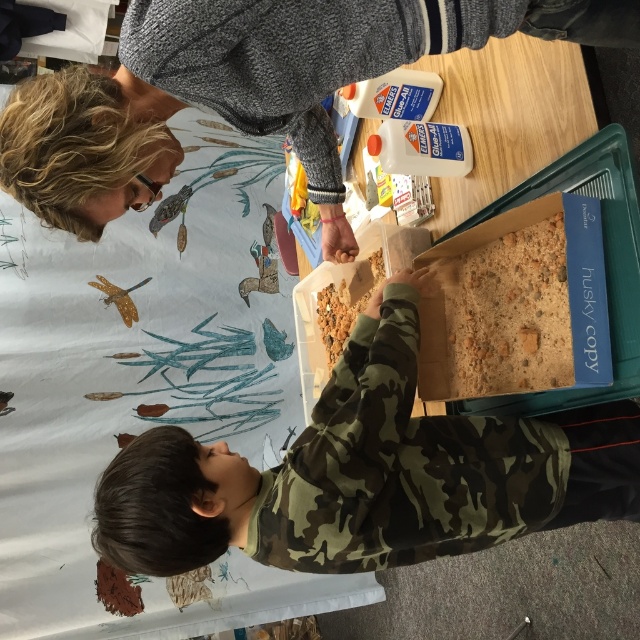
You are a teacher observing a classroom activity. You notice the camouflage fabric at center and the brown crumbly food at center. Which object takes up more space on the table?

The camouflage fabric at center is bigger than the brown crumbly food at center, so it takes up more space on the table.

You are observing a craft activity and need to determine the order of objects from closest to farthest. Which object is closer to you between the camouflage sweater at center and the brown crumbly food at center?

The camouflage sweater at center is closer to the viewer than the brown crumbly food at center according to the description.

You are standing in the classroom and want to reach the point marked at coordinates [484,467]. Can you estimate how far you need to walk to get there?

The distance between the point at coordinates [484,467] and your current position is 1.03 meters, so you need to walk approximately 1.03 meters to reach it.